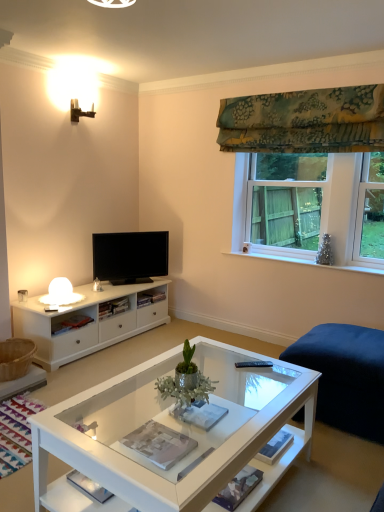
Question: From a real-world perspective, does green floral fabric at upper right sit lower than clear glass window at upper right?

Choices:
 (A) no
 (B) yes

Answer: (A)

Question: Is green floral fabric at upper right oriented away from clear glass window at upper right?

Choices:
 (A) yes
 (B) no

Answer: (B)

Question: Is green floral fabric at upper right shorter than clear glass window at upper right?

Choices:
 (A) no
 (B) yes

Answer: (B)

Question: Considering the relative positions of green floral fabric at upper right and clear glass window at upper right in the image provided, is green floral fabric at upper right in front of clear glass window at upper right?

Choices:
 (A) yes
 (B) no

Answer: (A)

Question: Is green floral fabric at upper right oriented towards clear glass window at upper right?

Choices:
 (A) yes
 (B) no

Answer: (B)

Question: In terms of size, does black glossy tv at center appear bigger or smaller than white glass coffee table at center?

Choices:
 (A) big
 (B) small

Answer: (B)

Question: Which is correct: black glossy tv at center is inside white glass coffee table at center, or outside of it?

Choices:
 (A) inside
 (B) outside

Answer: (B)

Question: From the image's perspective, relative to white glass coffee table at center, is black glossy tv at center above or below?

Choices:
 (A) below
 (B) above

Answer: (B)

Question: From their relative heights in the image, would you say black glossy tv at center is taller or shorter than white glass coffee table at center?

Choices:
 (A) short
 (B) tall

Answer: (B)

Question: Is clear glass window at upper right bigger or smaller than green metallic plant at center?

Choices:
 (A) big
 (B) small

Answer: (A)

Question: Choose the correct answer: Is clear glass window at upper right inside green metallic plant at center or outside it?

Choices:
 (A) outside
 (B) inside

Answer: (A)

Question: Does point (317, 159) appear closer or farther from the camera than point (185, 387)?

Choices:
 (A) farther
 (B) closer

Answer: (A)

Question: In terms of height, does clear glass window at upper right look taller or shorter compared to green metallic plant at center?

Choices:
 (A) short
 (B) tall

Answer: (B)

Question: Would you say black glossy tv at center is to the left or to the right of green metallic plant at center in the picture?

Choices:
 (A) left
 (B) right

Answer: (A)

Question: Looking at their shapes, would you say black glossy tv at center is wider or thinner than green metallic plant at center?

Choices:
 (A) wide
 (B) thin

Answer: (B)